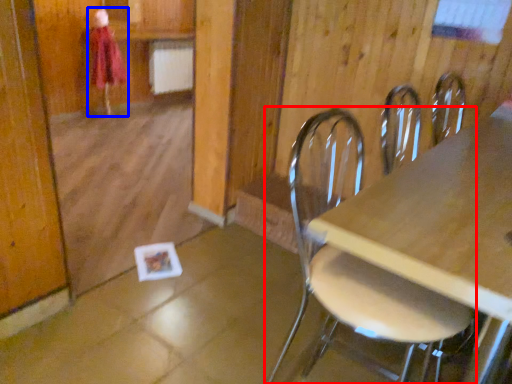
Question: Which object is closer to the camera taking this photo, chair (highlighted by a red box) or person (highlighted by a blue box)?

Choices:
 (A) chair
 (B) person

Answer: (A)